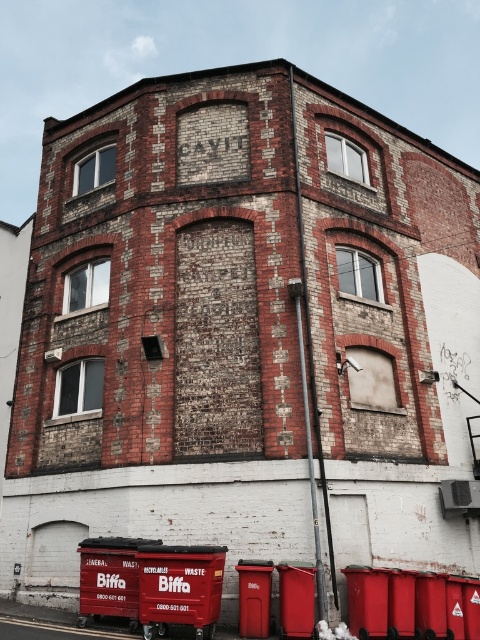
You are a delivery person trying to park your 1.2 meter wide van between the matte red bin at lower center and the metallic red bin at lower right. Can you fit your van there?

The matte red bin at lower center is wider than the metallic red bin at lower right. Since the van is 1.2 meters wide, you need to check the space between them. However, the description only mentions their widths, not the distance between them. Without knowing the distance between the bins, it is impossible to determine if the van can fit.

You are a delivery person who needs to place a large package on top of one of the bins. Which bin, the metallic red bin at lower right or the red plastic bin at lower center, can you place the package on without it falling off?

The red plastic bin at lower center is taller than the metallic red bin at lower right, so placing the package on the taller red plastic bin at lower center would provide a more stable surface and prevent it from falling off.